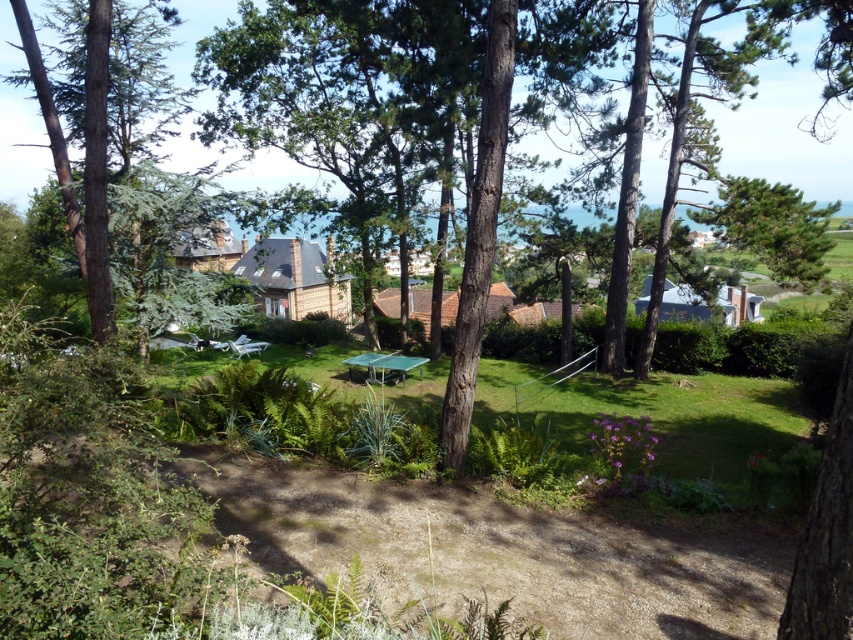
Question: Which point is closer to the camera taking this photo?

Choices:
 (A) (714, 500)
 (B) (769, 202)

Answer: (A)

Question: Among these objects, which one is nearest to the camera?

Choices:
 (A) green grass at center
 (B) green textured pine tree at upper right
 (C) green metallic picnic table at center

Answer: (A)

Question: Considering the relative positions of green grass at center and green metallic picnic table at center in the image provided, where is green grass at center located with respect to green metallic picnic table at center?

Choices:
 (A) right
 (B) left

Answer: (A)

Question: Can you confirm if green grass at center is thinner than green textured pine tree at upper right?

Choices:
 (A) no
 (B) yes

Answer: (A)

Question: Which of the following is the farthest from the observer?

Choices:
 (A) (x=827, y=214)
 (B) (x=775, y=333)

Answer: (B)

Question: Is green textured pine tree at upper right wider than green metallic picnic table at center?

Choices:
 (A) no
 (B) yes

Answer: (B)